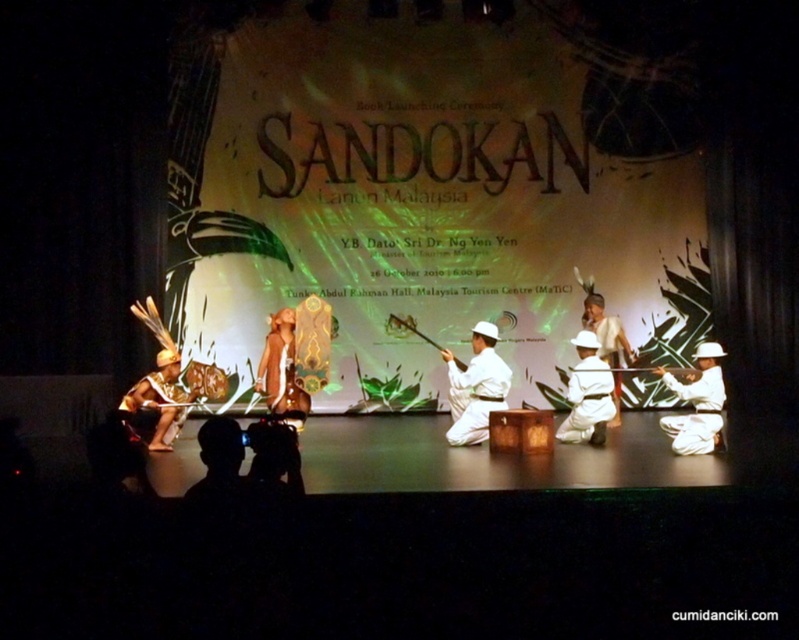
Question: Which is farther from the white matte helmet at center?

Choices:
 (A) white matte uniform at center
 (B) white matte kimono at center

Answer: (B)

Question: Is the position of white matte kimono at center less distant than that of matte gold helmet at lower left?

Choices:
 (A) yes
 (B) no

Answer: (B)

Question: Does white matte kimono at center have a larger size compared to silhouette fabric at lower center?

Choices:
 (A) no
 (B) yes

Answer: (A)

Question: Estimate the real-world distances between objects in this image. Which object is farther from the silhouette fabric at lower center?

Choices:
 (A) white matte uniform at center
 (B) white matte helmet at center
 (C) leather-like brown dress at center

Answer: (B)

Question: Is white matte uniform at center positioned before matte gold helmet at lower left?

Choices:
 (A) yes
 (B) no

Answer: (B)

Question: Which of these objects is positioned farthest from the white matte uniform at center?

Choices:
 (A) silhouette fabric at lower center
 (B) white matte/soft fabric at center

Answer: (A)